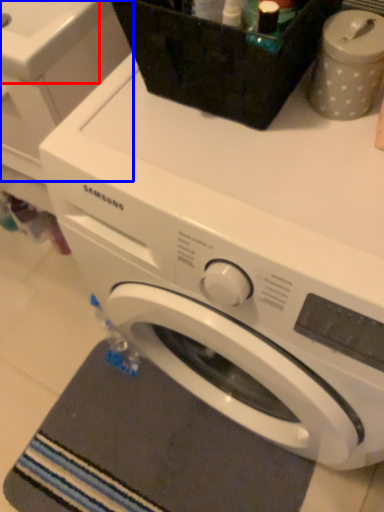
Question: Which object is closer to the camera taking this photo, sink (highlighted by a red box) or washing machine (highlighted by a blue box)?

Choices:
 (A) sink
 (B) washing machine

Answer: (B)